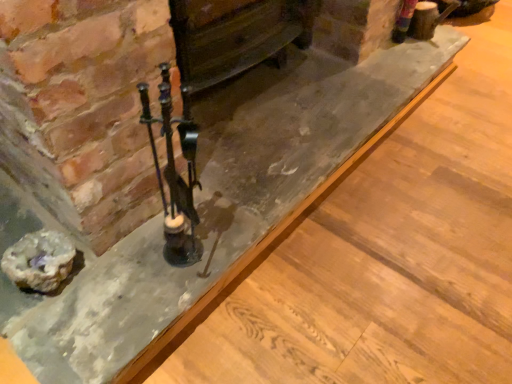
Identify the location of free location in front of gray marble at lower left. Image resolution: width=512 pixels, height=384 pixels. (47, 331).